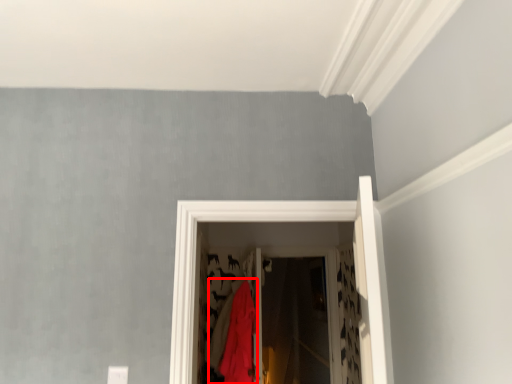
Question: From the image's perspective, considering the relative positions of clothing (annotated by the red box) and screen door in the image provided, where is clothing (annotated by the red box) located with respect to the staircase?

Choices:
 (A) below
 (B) above

Answer: (A)